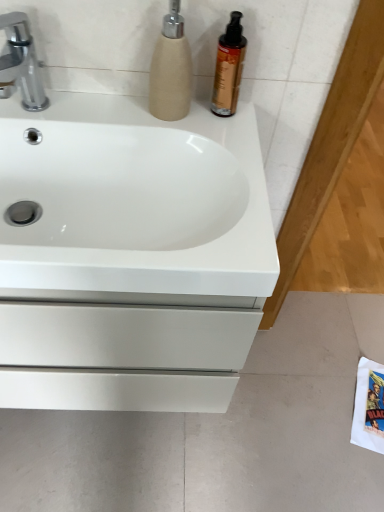
Identify the location of free space in front of beige textured soap dispenser at upper center. (193, 139).